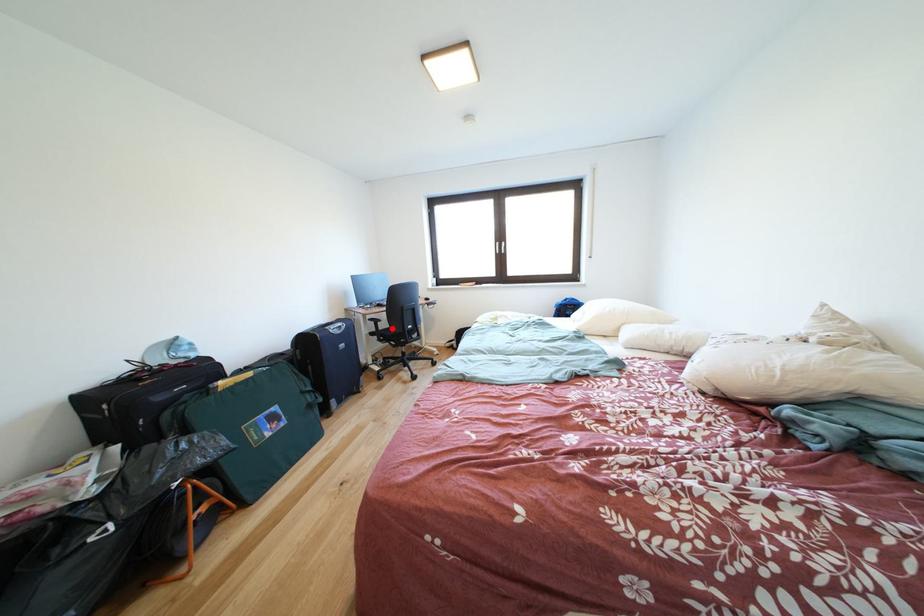
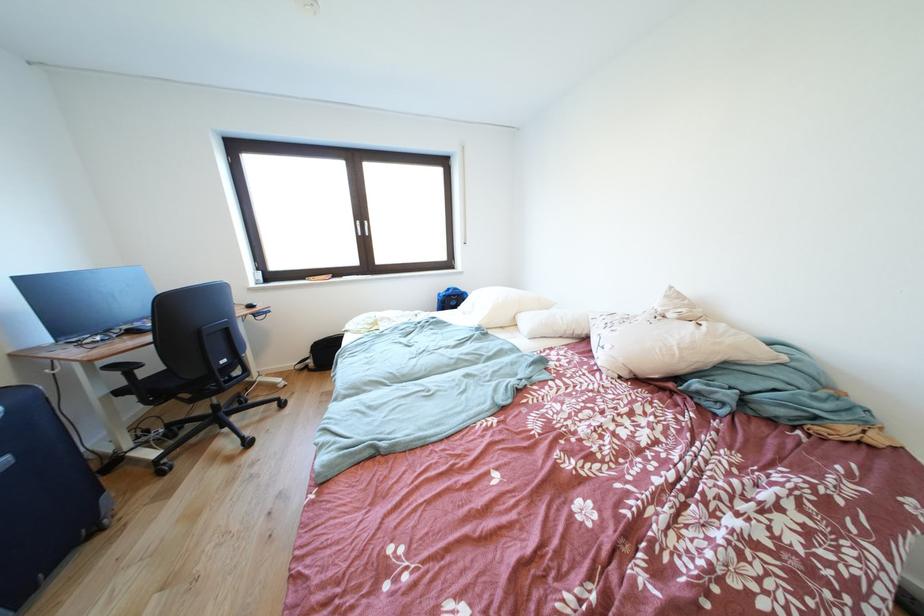
Question: I am providing you with two images of the same scene from different viewpoints. A red point is marked on the first image. At the location where the point appears in image 1, is it still visible in image 2?

Choices:
 (A) Yes
 (B) No

Answer: (A)